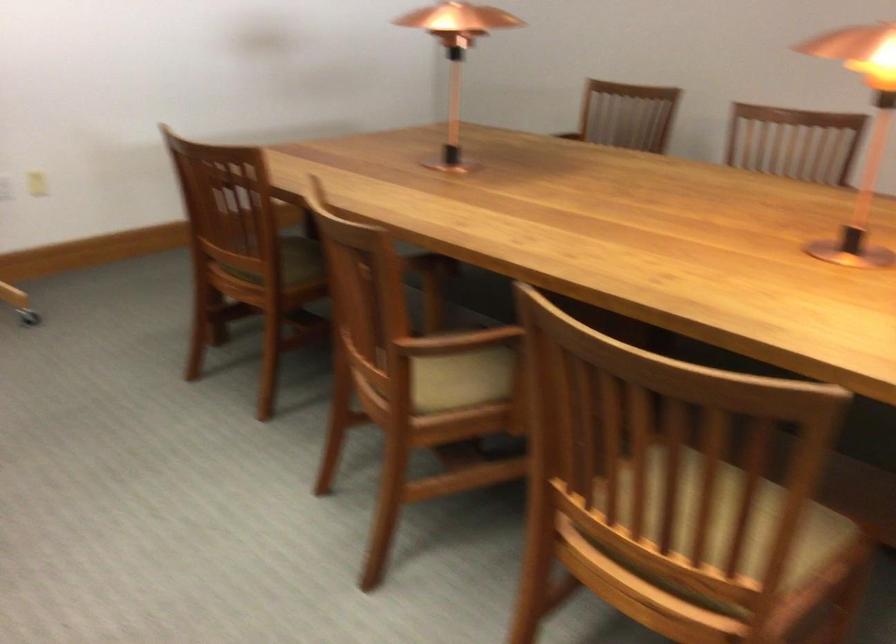
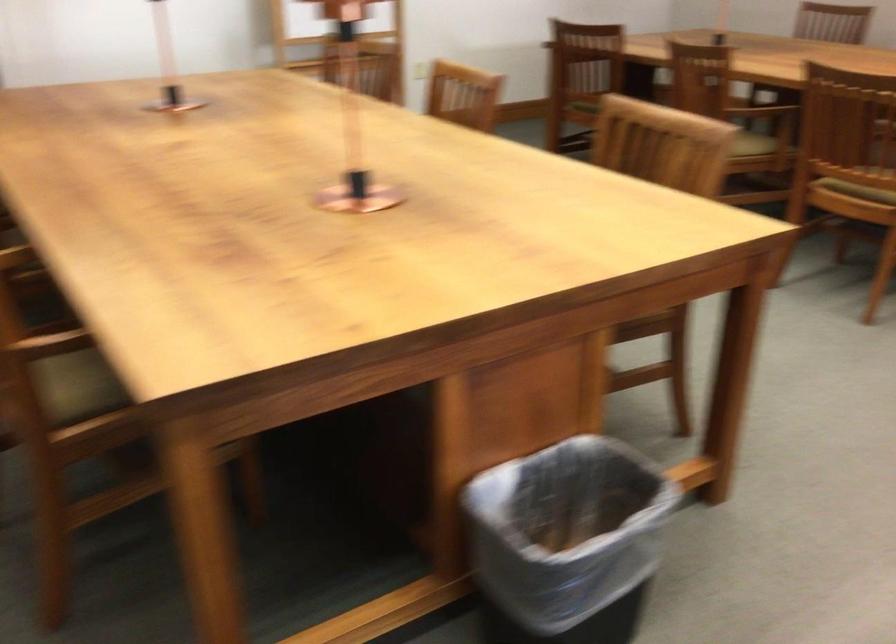
Locate, in the second image, the point that corresponds to the point at 455,433 in the first image.

(753, 144)